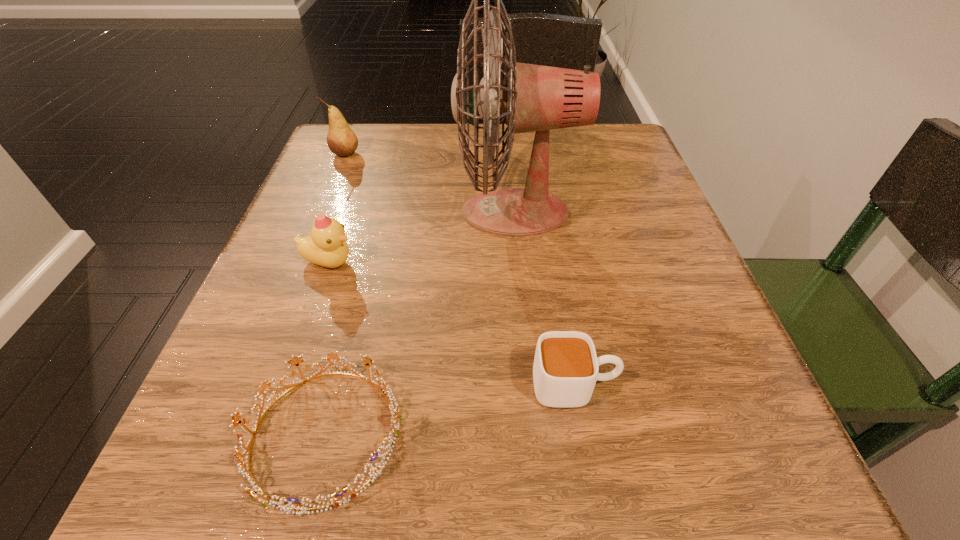
Where is `fan`? fan is located at coordinates (538, 98).

Where is `the second tallest object`? This screenshot has height=540, width=960. the second tallest object is located at coordinates (341, 140).

Image resolution: width=960 pixels, height=540 pixels. What are the coordinates of `pear` in the screenshot? It's located at (341, 140).

Where is `the third tallest object`? The height and width of the screenshot is (540, 960). the third tallest object is located at coordinates (326, 246).

At what (x,y) coordinates should I click in order to perform the action: click on cup. Please return your answer as a coordinate pair (x, y). The image size is (960, 540). Looking at the image, I should click on (565, 370).

Locate an element on the screen. The width and height of the screenshot is (960, 540). tiara is located at coordinates (395, 415).

Find the location of a particular element. vacant space located in front of the tallest object to direct airflow is located at coordinates (385, 212).

Where is `free space located in front of the tallest object to direct airflow`? free space located in front of the tallest object to direct airflow is located at coordinates (401, 212).

Where is `vacant area located in front of the tallest object to direct airflow`? The height and width of the screenshot is (540, 960). vacant area located in front of the tallest object to direct airflow is located at coordinates (373, 212).

The image size is (960, 540). In order to click on free space located on the front of the fourth shortest object in this screenshot , I will do `click(287, 299)`.